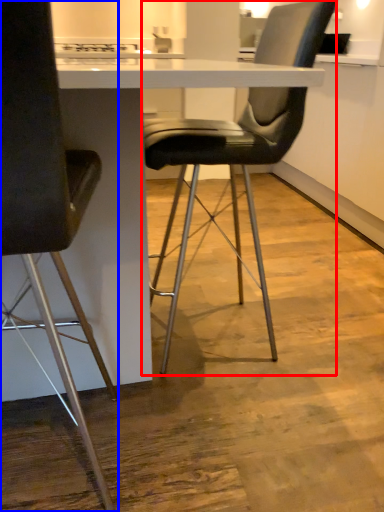
Question: Which object is further to the camera taking this photo, chair (highlighted by a red box) or chair (highlighted by a blue box)?

Choices:
 (A) chair
 (B) chair

Answer: (A)